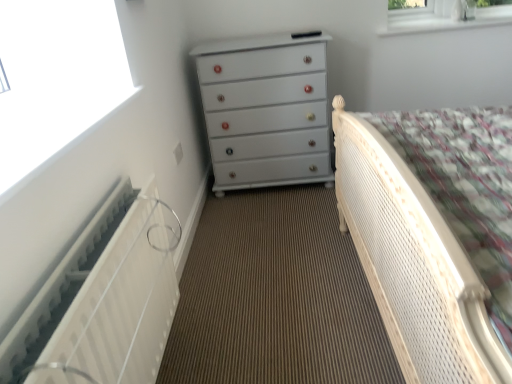
Question: Is white glossy chest of drawers at center inside or outside of white cane bed at right?

Choices:
 (A) inside
 (B) outside

Answer: (B)

Question: Considering the positions of white glossy chest of drawers at center and white cane bed at right in the image, is white glossy chest of drawers at center bigger or smaller than white cane bed at right?

Choices:
 (A) big
 (B) small

Answer: (B)

Question: Which of these objects is positioned closest to the white glossy chest of drawers at center?

Choices:
 (A) white textured radiator at left
 (B) white glossy radiator at left
 (C) white cane bed at right

Answer: (C)

Question: Which is farther from the white textured radiator at left?

Choices:
 (A) white glossy chest of drawers at center
 (B) white cane bed at right
 (C) white glossy radiator at left

Answer: (A)